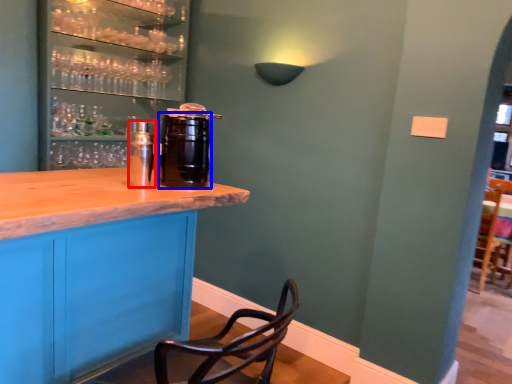
Question: Which object is closer to the camera taking this photo, beverage (highlighted by a red box) or beverage (highlighted by a blue box)?

Choices:
 (A) beverage
 (B) beverage

Answer: (B)